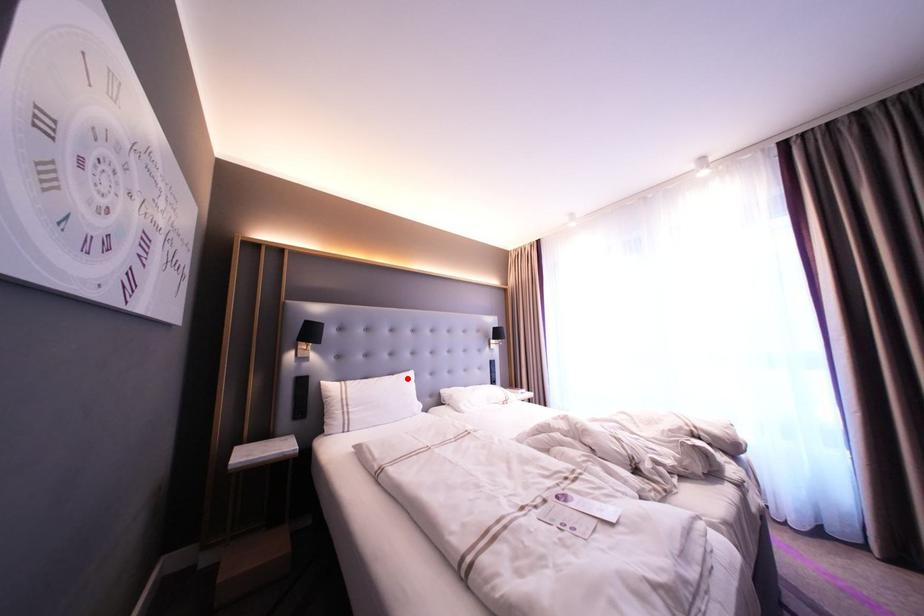
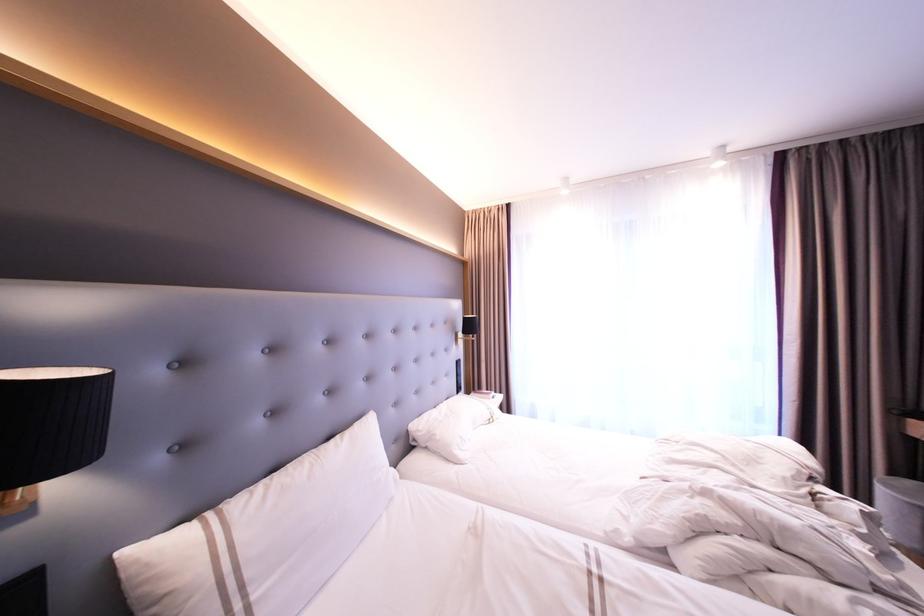
Locate, in the second image, the point that corresponds to the highlighted location in the first image.

(365, 435)